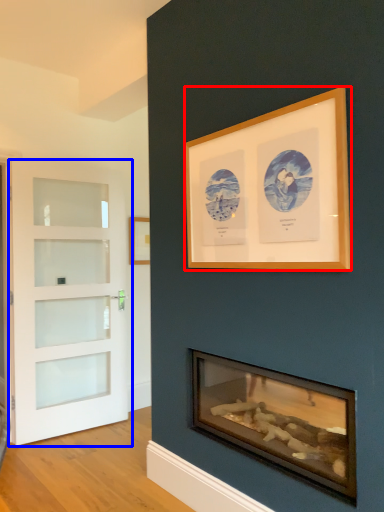
Question: Which object appears farthest to the camera in this image, picture frame (highlighted by a red box) or door (highlighted by a blue box)?

Choices:
 (A) picture frame
 (B) door

Answer: (B)